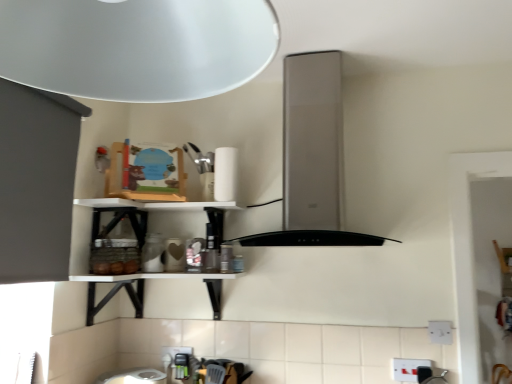
Question: From the image's perspective, is white matte paper towel at upper center on top of white plastic electric outlet at lower right, the third electric outlet when ordered from left to right?

Choices:
 (A) no
 (B) yes

Answer: (B)

Question: Would you say white plastic electric outlet at lower right, the 3th electric outlet when ordered from bottom to top, is part of white matte paper towel at upper center's contents?

Choices:
 (A) no
 (B) yes

Answer: (A)

Question: From a real-world perspective, does white matte paper towel at upper center stand above white plastic electric outlet at lower right, the 3th electric outlet when ordered from bottom to top?

Choices:
 (A) no
 (B) yes

Answer: (B)

Question: Would you consider white matte paper towel at upper center to be distant from white plastic electric outlet at lower right, arranged as the 1th electric outlet when viewed from the top?

Choices:
 (A) yes
 (B) no

Answer: (A)

Question: From the image's perspective, is white matte paper towel at upper center located beneath white plastic electric outlet at lower right, the second electric outlet viewed from the back?

Choices:
 (A) yes
 (B) no

Answer: (B)

Question: Do you think white plastic electric outlet at lower right, positioned as the second electric outlet in top-to-bottom order, is within satin silver vent at center, or outside of it?

Choices:
 (A) outside
 (B) inside

Answer: (A)

Question: Relative to satin silver vent at center, is white plastic electric outlet at lower right, the 2th electric outlet ordered from the bottom, in front or behind?

Choices:
 (A) front
 (B) behind

Answer: (B)

Question: Considering the positions of white plastic electric outlet at lower right, acting as the 3th electric outlet starting from the back, and satin silver vent at center in the image, is white plastic electric outlet at lower right, acting as the 3th electric outlet starting from the back, wider or thinner than satin silver vent at center?

Choices:
 (A) wide
 (B) thin

Answer: (B)

Question: From the image's perspective, is white plastic electric outlet at lower right, the 2th electric outlet ordered from the bottom, above or below satin silver vent at center?

Choices:
 (A) below
 (B) above

Answer: (A)

Question: Relative to white plastic electric outlet at lower right, the 3th electric outlet when ordered from bottom to top, is white plastic electric outlet at lower right, positioned as the second electric outlet in top-to-bottom order, in front or behind?

Choices:
 (A) front
 (B) behind

Answer: (A)

Question: From their relative heights in the image, would you say white plastic electric outlet at lower right, acting as the 3th electric outlet starting from the back, is taller or shorter than white plastic electric outlet at lower right, positioned as the 1th electric outlet in right-to-left order?

Choices:
 (A) tall
 (B) short

Answer: (B)

Question: Would you say white plastic electric outlet at lower right, acting as the 3th electric outlet starting from the back, is to the left or to the right of white plastic electric outlet at lower right, the second electric outlet viewed from the back, in the picture?

Choices:
 (A) left
 (B) right

Answer: (A)

Question: From the image's perspective, is white plastic electric outlet at lower right, positioned as the second electric outlet in top-to-bottom order, above or below white plastic electric outlet at lower right, the 3th electric outlet when ordered from bottom to top?

Choices:
 (A) below
 (B) above

Answer: (A)

Question: Do you think white plastic electric outlet at lower right, the second electric outlet from the front, is within white plastic electric outlet at lower center, which is the 3th electric outlet from right to left, or outside of it?

Choices:
 (A) outside
 (B) inside

Answer: (A)

Question: In terms of height, does white plastic electric outlet at lower right, the 3th electric outlet when ordered from bottom to top, look taller or shorter compared to white plastic electric outlet at lower center, placed as the first electric outlet when sorted from left to right?

Choices:
 (A) short
 (B) tall

Answer: (A)